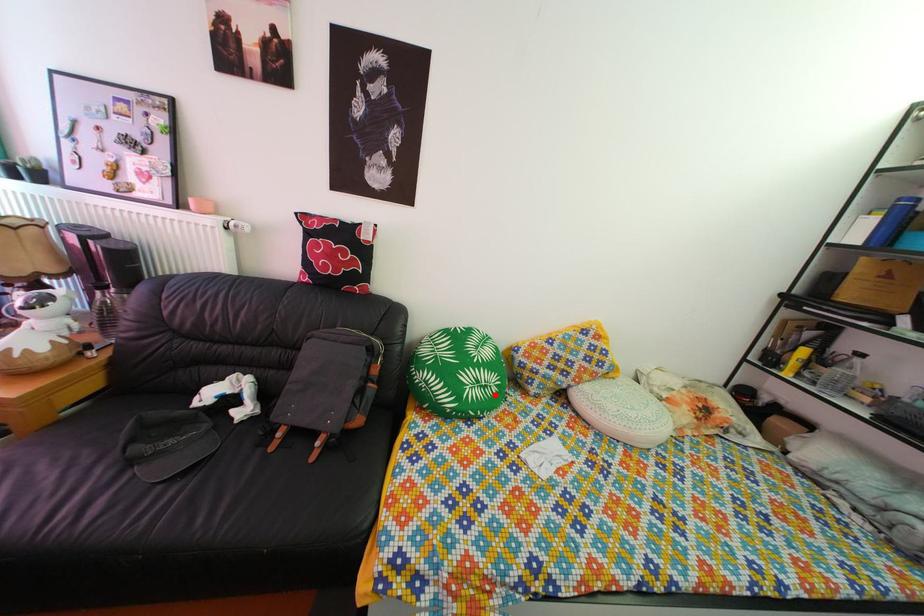
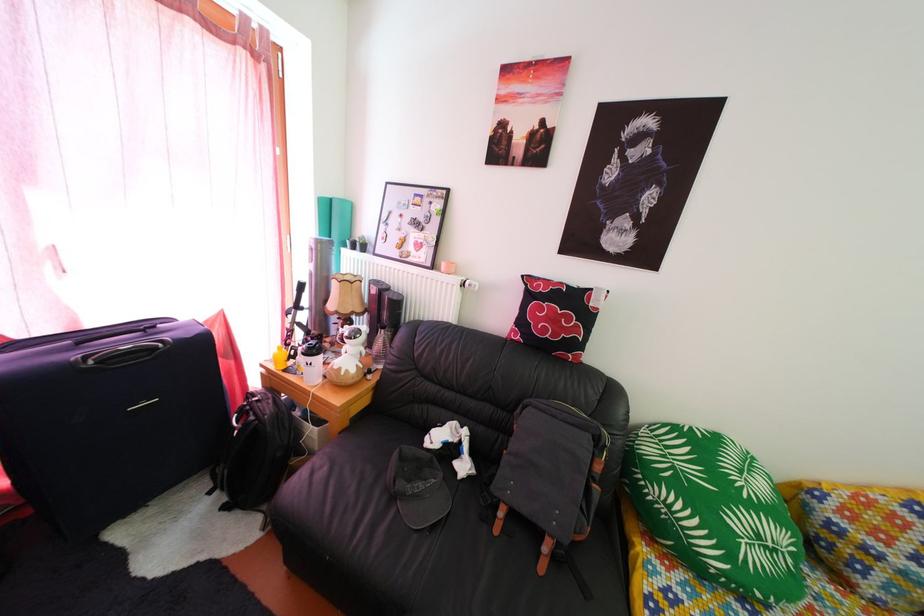
Question: I am providing you with two images of the same scene from different viewpoints. A red point is shown in image1. For the corresponding object point in image2, is it positioned nearer or farther from the camera?

Choices:
 (A) Nearer
 (B) Farther

Answer: (A)